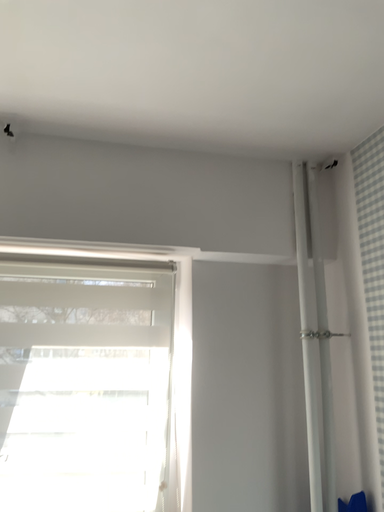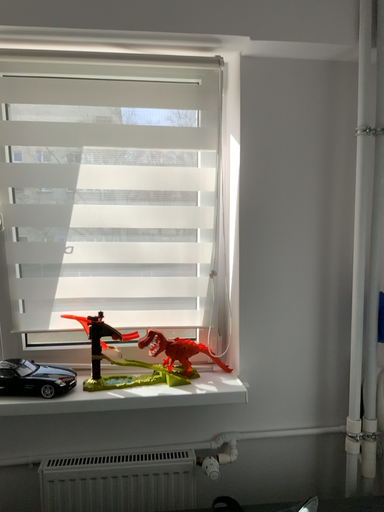
Question: Which way did the camera rotate in the video?

Choices:
 (A) rotated downward
 (B) rotated upward

Answer: (A)